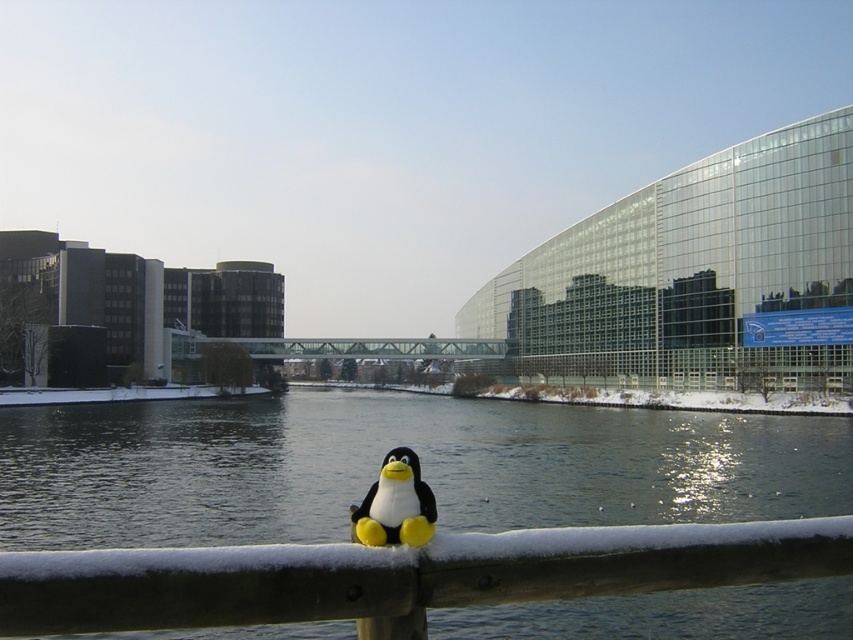
Looking at this image, you are a photographer standing at the edge of the wooden railing in the winter scene. You want to capture a photo where both the clear water at railing center and the matte plush penguin at center are in the frame. Given that your camera has a maximum focal length that allows capturing objects up to 200 feet apart, will you be able to include both subjects in the same shot?

The clear water at railing center and the matte plush penguin at center are 187.49 feet apart from each other. Since the distance between them is within the camera maximum focal length of 200 feet, you can capture both subjects in the same shot.